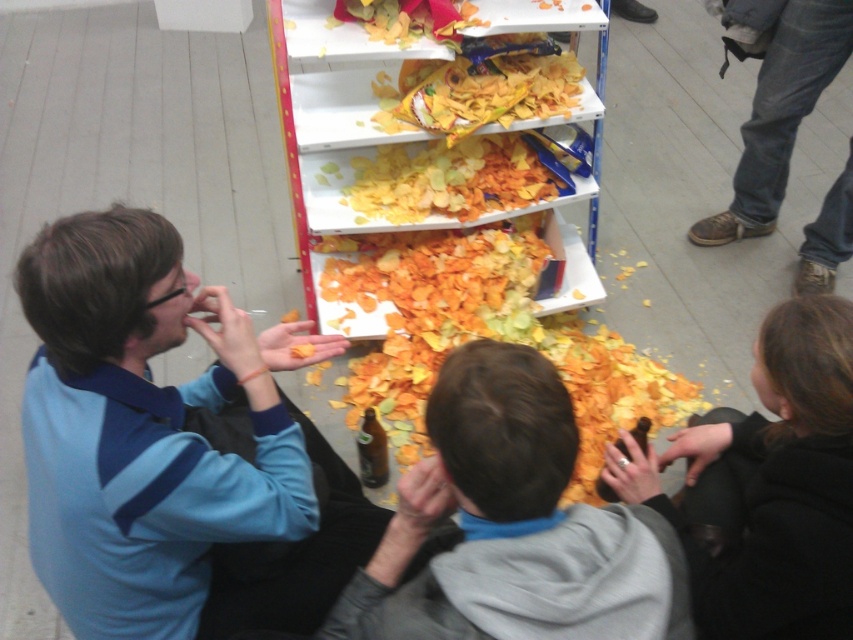
Question: Among these objects, which one is nearest to the camera?

Choices:
 (A) denim jeans at right
 (B) crinkled paper chips at center

Answer: (B)

Question: Observing the image, what is the correct spatial positioning of crinkled paper chips at center in reference to denim jeans at right?

Choices:
 (A) above
 (B) below

Answer: (B)

Question: Based on their relative distances, which object is farther from the crinkled paper chips at center?

Choices:
 (A) gray hoodie at center
 (B) denim jeans at right

Answer: (A)

Question: Does denim jeans at right appear on the left side of matte plastic chips at center?

Choices:
 (A) no
 (B) yes

Answer: (A)

Question: Can you confirm if gray hoodie at center is positioned to the right of denim jeans at right?

Choices:
 (A) no
 (B) yes

Answer: (A)

Question: Estimate the real-world distances between objects in this image. Which object is closer to the gray hoodie at center?

Choices:
 (A) matte plastic chips at center
 (B) denim jeans at right

Answer: (A)